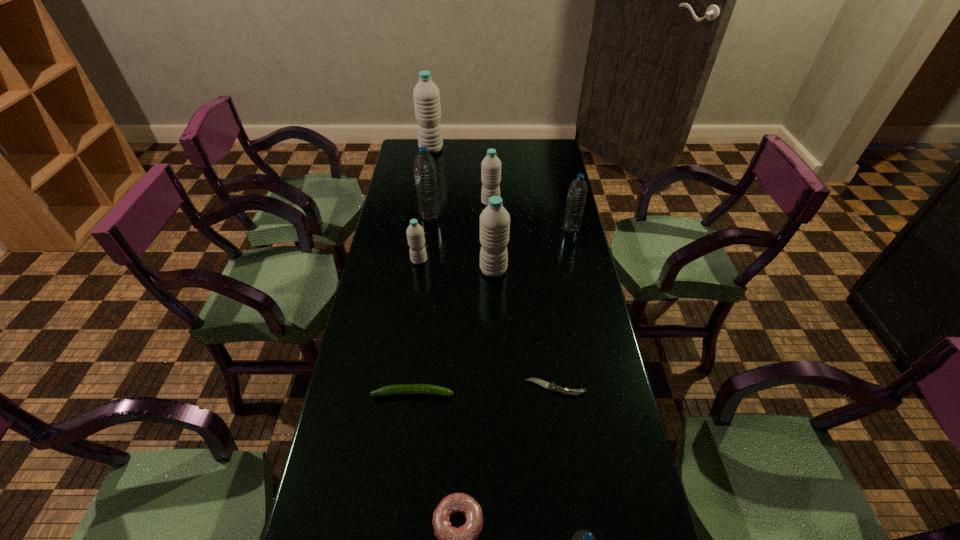
Identify the location of zucchini. This screenshot has height=540, width=960. [401, 389].

The width and height of the screenshot is (960, 540). I want to click on the shortest object, so click(551, 386).

Identify the location of free space located on the front of the farthest water bottle. The image size is (960, 540). (429, 163).

Where is `free region located 0.080m on the front of the second biggest white water bottle`? The width and height of the screenshot is (960, 540). free region located 0.080m on the front of the second biggest white water bottle is located at coordinates (494, 298).

At what (x,y) coordinates should I click in order to perform the action: click on free spot located on the right of the farthest blue water bottle. Please return your answer as a coordinate pair (x, y). Looking at the image, I should click on (518, 217).

Identify the location of vacant space located 0.340m on the left of the rightmost blue water bottle. (473, 229).

Locate an element on the screen. vacant area situated on the right of the third biggest white water bottle is located at coordinates (561, 203).

Where is `free space located on the right of the smallest white water bottle`? free space located on the right of the smallest white water bottle is located at coordinates (452, 261).

Locate an element on the screen. The width and height of the screenshot is (960, 540). vacant space situated 0.340m on the front-facing side of the ninth tallest object is located at coordinates (579, 394).

Where is `free region located 0.050m on the front of the shortest object`? The height and width of the screenshot is (540, 960). free region located 0.050m on the front of the shortest object is located at coordinates (559, 415).